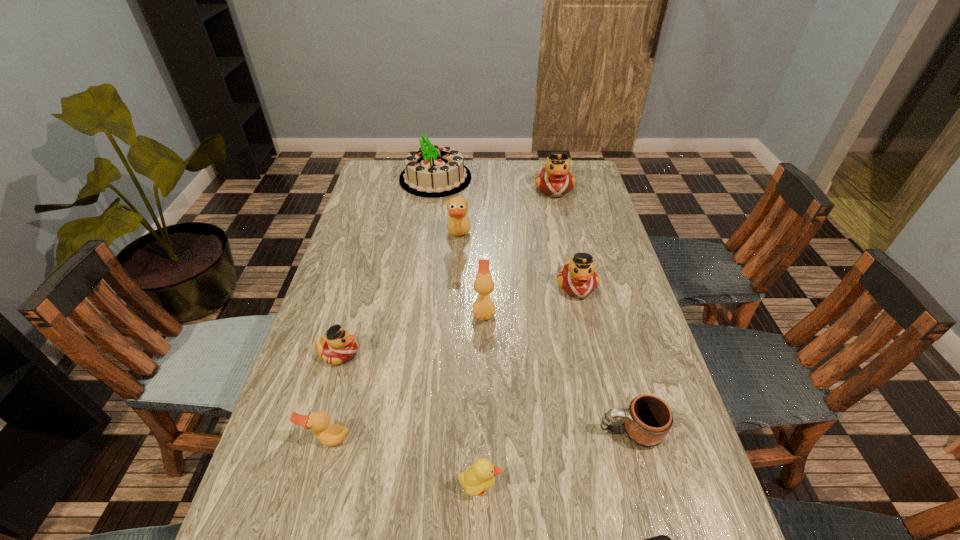
Where is `the nearest tan duck`? This screenshot has height=540, width=960. the nearest tan duck is located at coordinates (329, 435).

The width and height of the screenshot is (960, 540). In order to click on the smallest tan duck in this screenshot , I will do `click(329, 435)`.

At what (x,y) coordinates should I click in order to perform the action: click on duckling. Please return your answer as a coordinate pair (x, y). This screenshot has height=540, width=960. Looking at the image, I should click on (480, 477).

Image resolution: width=960 pixels, height=540 pixels. I want to click on the ninth farthest object, so click(480, 477).

Locate an element on the screen. mug is located at coordinates (648, 419).

The width and height of the screenshot is (960, 540). Identify the location of free location located on the right of the birthday cake. (492, 178).

Where is `vacant space located 0.220m on the face of the biggest red duck`? vacant space located 0.220m on the face of the biggest red duck is located at coordinates (565, 237).

You are a GUI agent. You are given a task and a screenshot of the screen. Output one action in this format:
    pyautogui.click(x=<x>, y=<y>)
    Task: Click on the vacant area located on the beak of the second farthest duck
    
    Given the screenshot: What is the action you would take?
    pyautogui.click(x=567, y=237)

Identify the location of free space located 0.090m on the face of the second farthest red duck. (587, 327).

Find the location of a particular element. Image resolution: width=960 pixels, height=540 pixels. vacant space situated 0.250m on the beak of the fourth duck from left to right is located at coordinates (x=384, y=310).